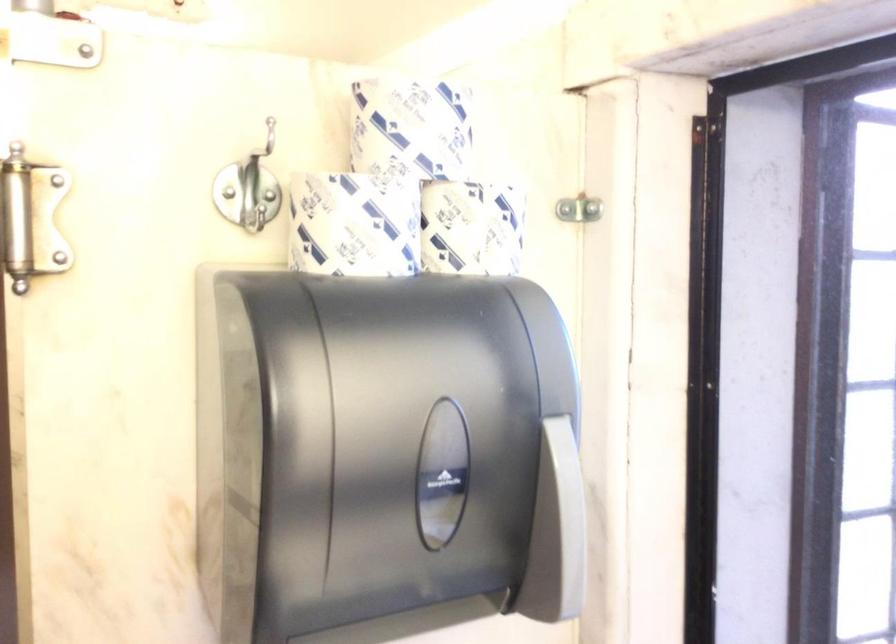
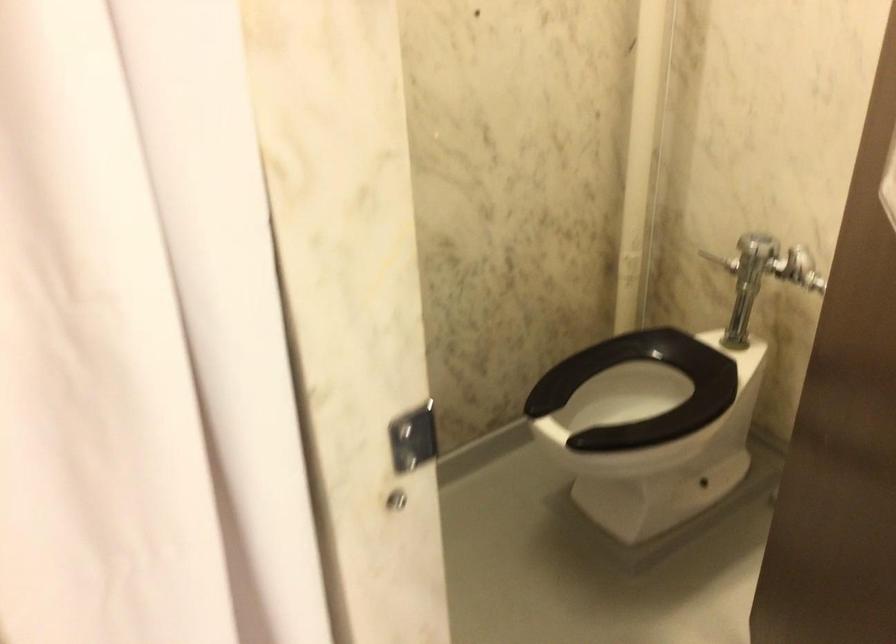
Question: Which direction would the cameraman need to move to produce the second image? Reply with the corresponding letter.

Choices:
 (A) Left
 (B) Right
 (C) Forward
 (D) Backward

Answer: (A)